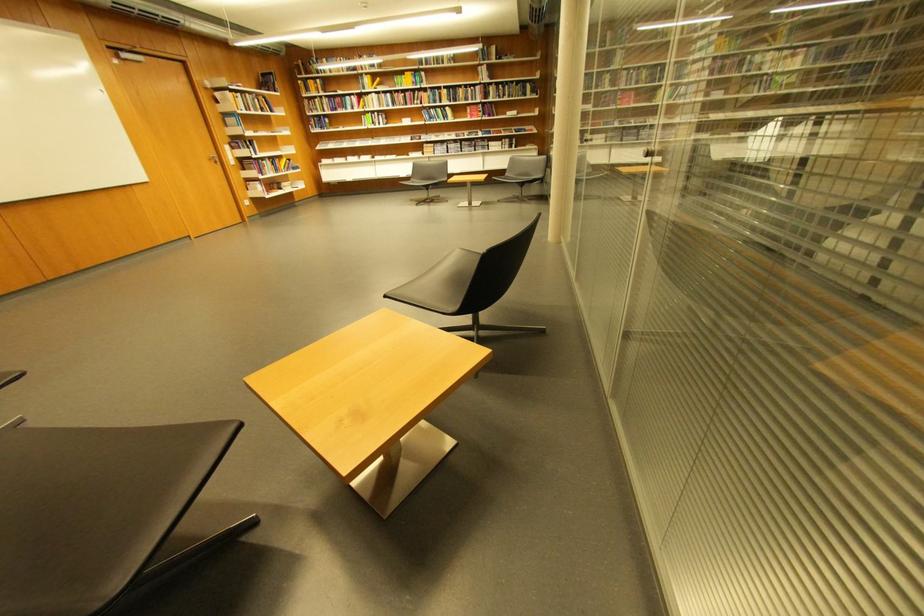
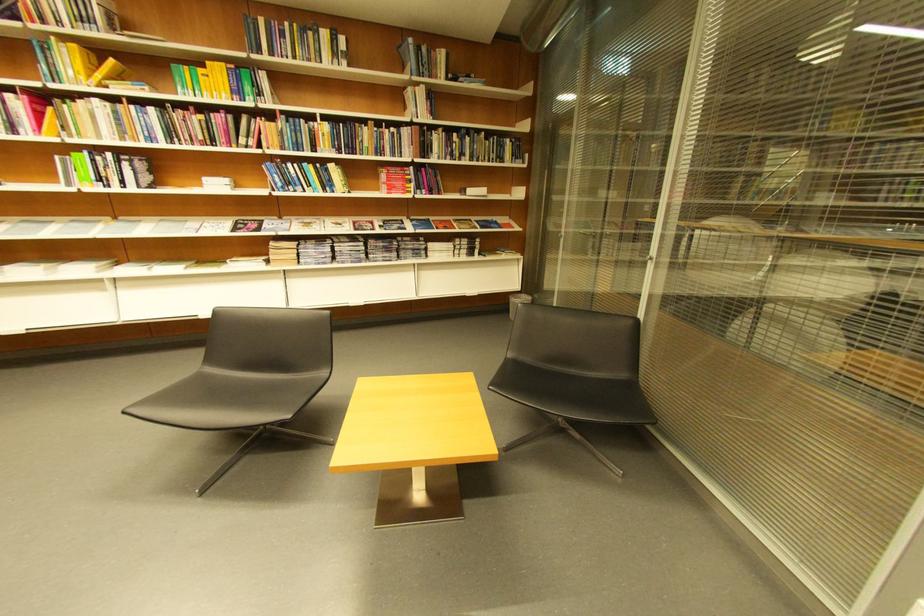
Where in the second image is the point corresponding to point 420,74 from the first image?

(234, 66)